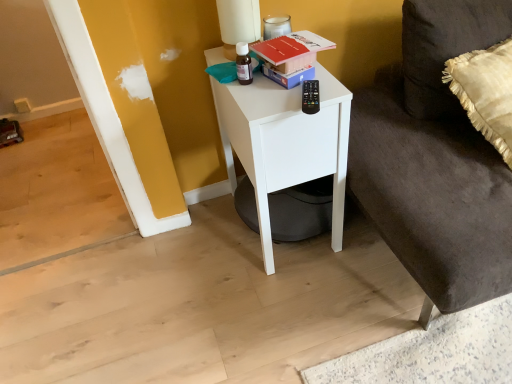
Question: Is red matte book at upper center located within dark gray fabric couch at lower right?

Choices:
 (A) no
 (B) yes

Answer: (A)

Question: Is dark gray fabric couch at lower right to the right of red matte book at upper center from the viewer's perspective?

Choices:
 (A) no
 (B) yes

Answer: (B)

Question: Does dark gray fabric couch at lower right lie behind red matte book at upper center?

Choices:
 (A) yes
 (B) no

Answer: (B)

Question: From a real-world perspective, is dark gray fabric couch at lower right positioned under red matte book at upper center based on gravity?

Choices:
 (A) no
 (B) yes

Answer: (B)

Question: Is dark gray fabric couch at lower right positioned beyond the bounds of red matte book at upper center?

Choices:
 (A) no
 (B) yes

Answer: (B)

Question: Is red matte book at upper center taller or shorter than matte white table lamp at upper center?

Choices:
 (A) short
 (B) tall

Answer: (A)

Question: Do you think red matte book at upper center is within matte white table lamp at upper center, or outside of it?

Choices:
 (A) inside
 (B) outside

Answer: (B)

Question: Looking at the image, does red matte book at upper center seem bigger or smaller compared to matte white table lamp at upper center?

Choices:
 (A) big
 (B) small

Answer: (B)

Question: Considering the relative positions of red matte book at upper center and matte white table lamp at upper center in the image provided, is red matte book at upper center to the left or to the right of matte white table lamp at upper center?

Choices:
 (A) left
 (B) right

Answer: (B)

Question: Is white matte nightstand at center bigger or smaller than red matte book at upper center?

Choices:
 (A) big
 (B) small

Answer: (A)

Question: Is white matte nightstand at center spatially inside red matte book at upper center, or outside of it?

Choices:
 (A) inside
 (B) outside

Answer: (B)

Question: Is white matte nightstand at center in front of or behind red matte book at upper center in the image?

Choices:
 (A) behind
 (B) front

Answer: (B)

Question: From the image's perspective, is white matte nightstand at center above or below red matte book at upper center?

Choices:
 (A) below
 (B) above

Answer: (A)

Question: From their relative heights in the image, would you say white matte nightstand at center is taller or shorter than matte white table lamp at upper center?

Choices:
 (A) tall
 (B) short

Answer: (A)

Question: Based on their sizes in the image, would you say white matte nightstand at center is bigger or smaller than matte white table lamp at upper center?

Choices:
 (A) small
 (B) big

Answer: (B)